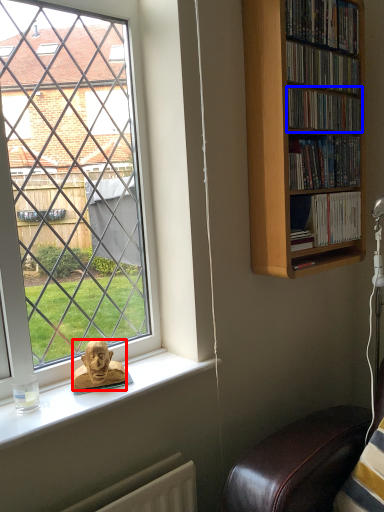
Question: Which of the following is the closest to the observer, person (highlighted by a red box) or book (highlighted by a blue box)?

Choices:
 (A) person
 (B) book

Answer: (A)